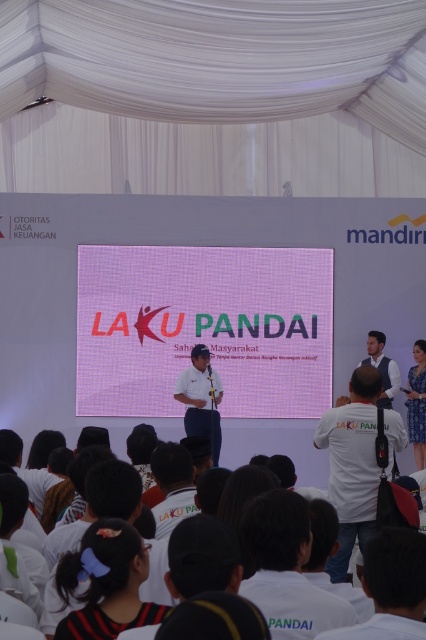
Question: Does white glossy shirt at center appear under blue printed dress at center?

Choices:
 (A) no
 (B) yes

Answer: (A)

Question: Which point is closer to the camera?

Choices:
 (A) white cotton t-shirts at lower center
 (B) white glossy shirt at center

Answer: (A)

Question: Among these points, which one is nearest to the camera?

Choices:
 (A) (192, 385)
 (B) (412, 392)
 (C) (236, 456)

Answer: (A)

Question: Observing the image, what is the correct spatial positioning of pink grid projection screen at center in reference to white matte shirt at center?

Choices:
 (A) right
 (B) left

Answer: (B)

Question: Which of the following is the closest to the observer?

Choices:
 (A) (215, 381)
 (B) (409, 413)

Answer: (A)

Question: Is pink grid projection screen at center smaller than white cotton t-shirts at lower center?

Choices:
 (A) no
 (B) yes

Answer: (B)